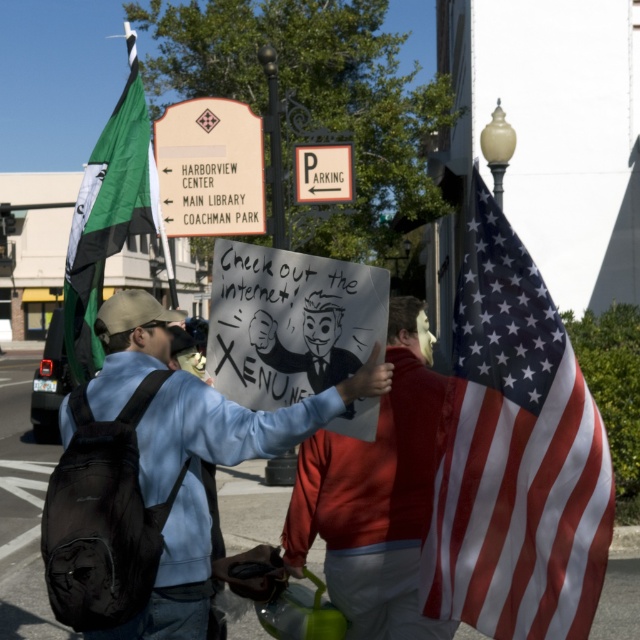
What are the coordinates of the red cotton hoodie at center?

The red cotton hoodie at center is located at coordinates point (376,493).

You are a fashion designer observing two people in the image. You notice they are both wearing jackets. Which one is positioned to the right of the other? The jackets are labeled as red cotton hoodie at center and matte blue sweatshirt at center. Please specify which jacket is on the right side.

→ The red cotton hoodie at center is positioned to the right of the matte blue sweatshirt at center.